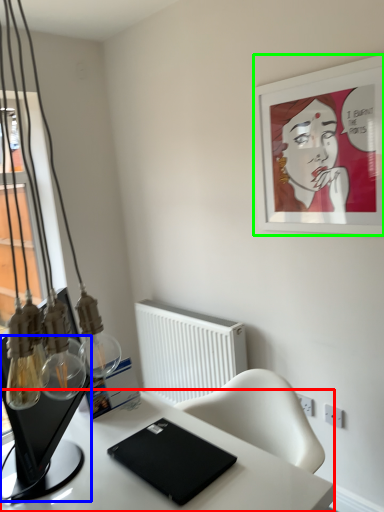
Question: Considering the real-world distances, which object is farthest from desk (highlighted by a red box)? computer monitor (highlighted by a blue box) or picture frame (highlighted by a green box)?

Choices:
 (A) computer monitor
 (B) picture frame

Answer: (B)